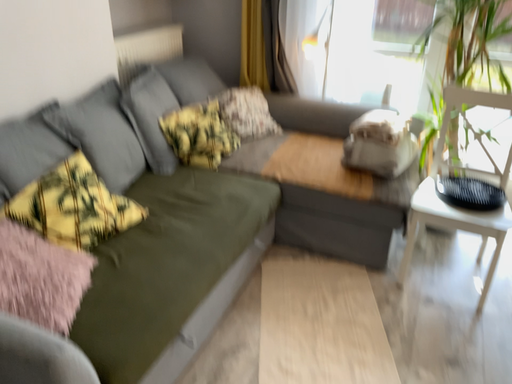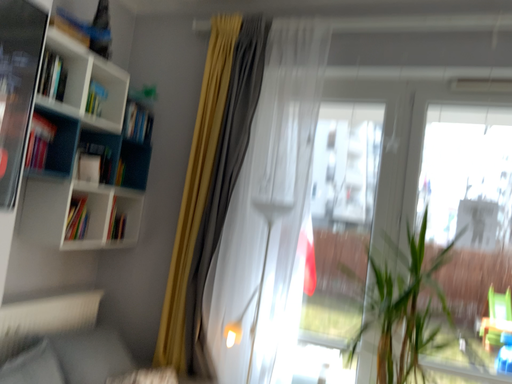
Question: Which way did the camera rotate in the video?

Choices:
 (A) rotated upward
 (B) rotated downward

Answer: (A)